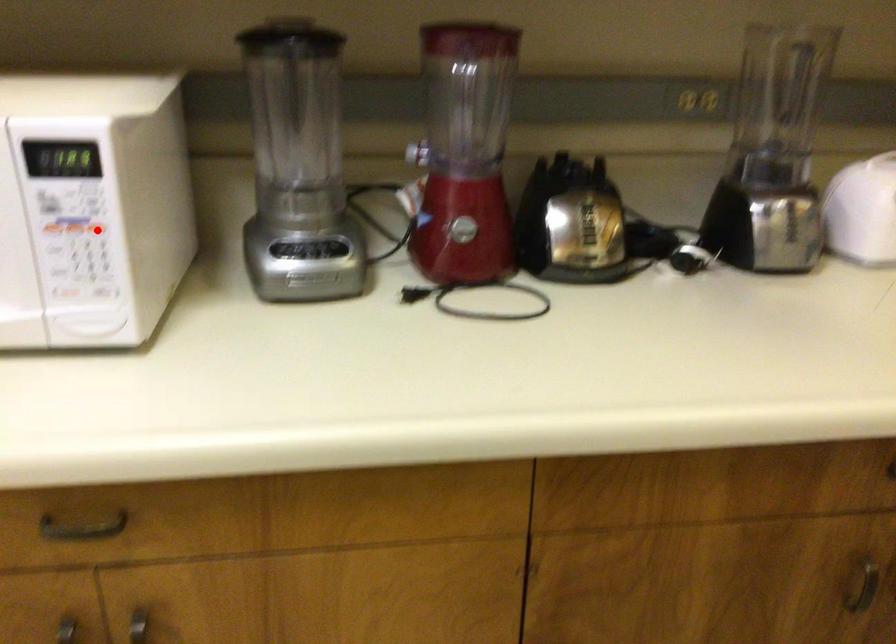
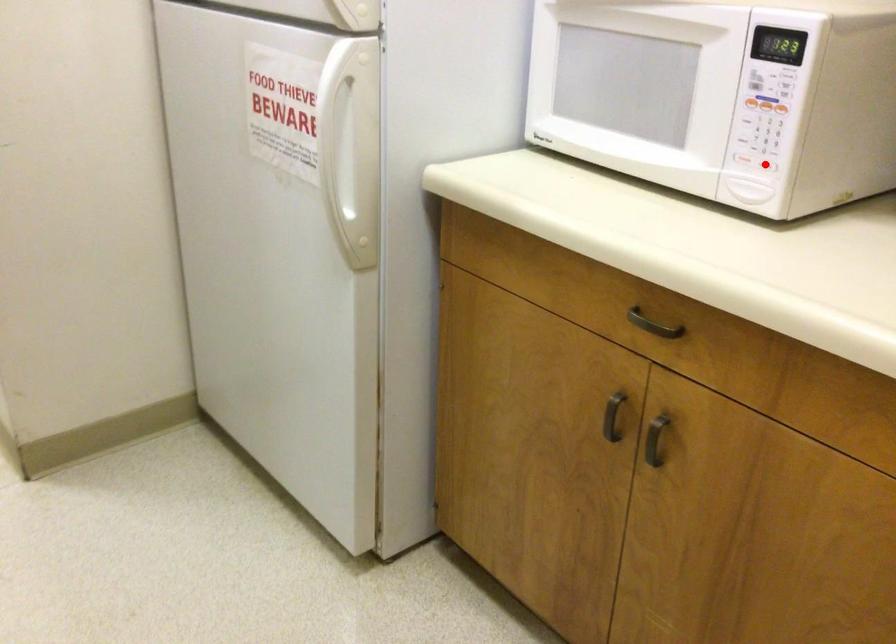
I am providing you with two images of the same scene from different viewpoints. A red point is marked on the first image and another point is marked on the second image. Is the marked point in image1 the same physical position as the marked point in image2?

No